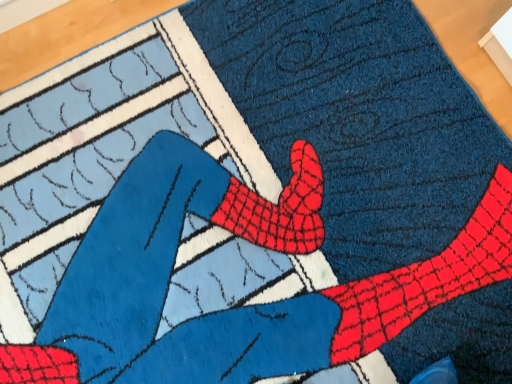
This screenshot has width=512, height=384. What are the coordinates of `vacant space underneath red spiderweb-patterned socks at center (from a real-world perspective)` in the screenshot? It's located at (259, 218).